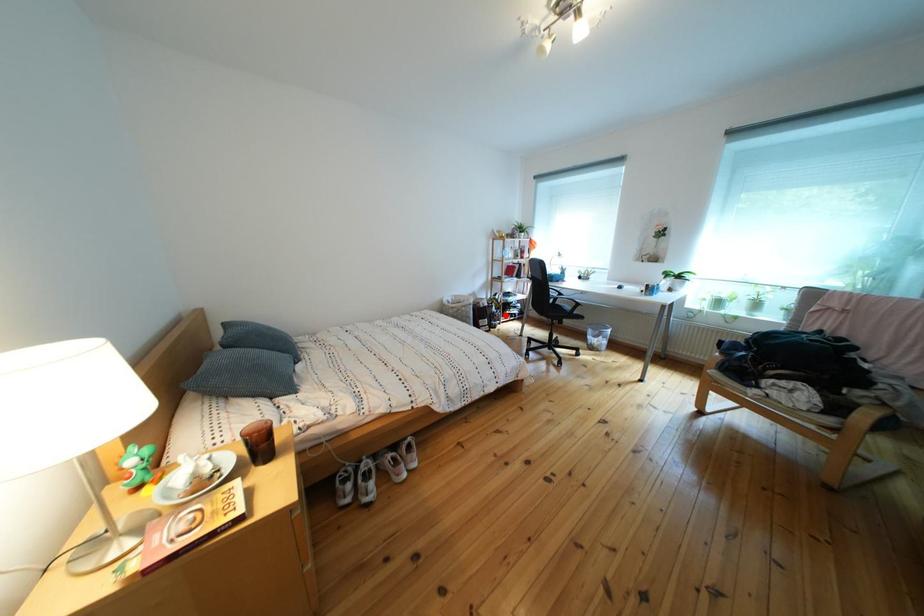
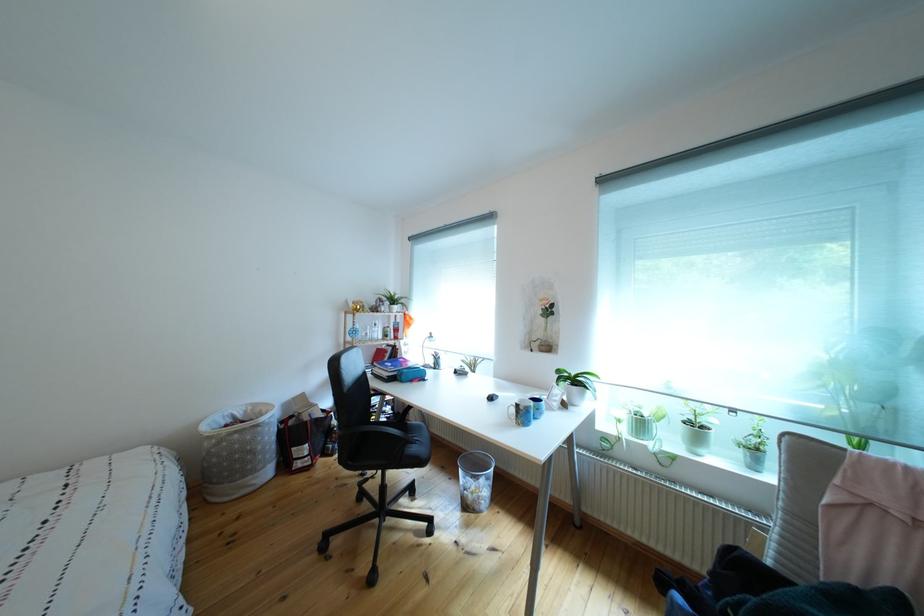
Question: A red point is marked in image1. In image2, is the corresponding 3D point closer to the camera or farther? Reply with the corresponding letter.

Choices:
 (A) The corresponding 3D point is closer.
 (B) The corresponding 3D point is farther.

Answer: (B)